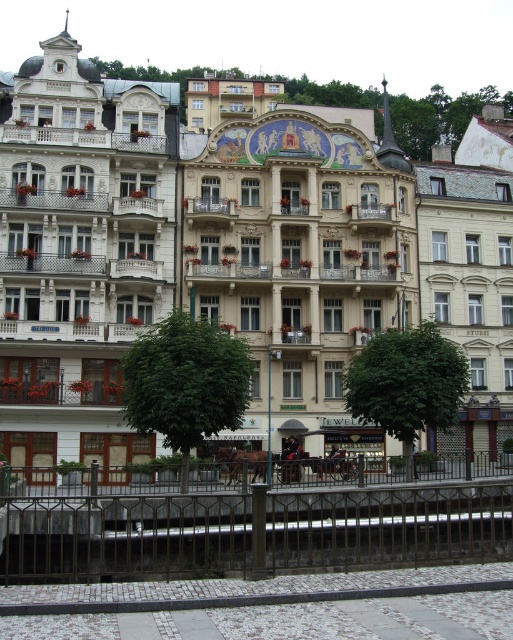
Question: Among these points, which one is farthest from the camera?

Choices:
 (A) (114, 260)
 (B) (207, 218)
 (C) (155, 200)

Answer: (B)

Question: Does white textured building at left lie in front of white stone balcony at center?

Choices:
 (A) no
 (B) yes

Answer: (B)

Question: Does white textured building at left appear under white wrought iron balcony at center?

Choices:
 (A) no
 (B) yes

Answer: (A)

Question: Is white textured building at left positioned at the back of wooden balcony at left?

Choices:
 (A) no
 (B) yes

Answer: (A)

Question: Which point appears closest to the camera in this image?

Choices:
 (A) (231, 262)
 (B) (60, 141)

Answer: (A)

Question: Which of the following is the closest to the observer?

Choices:
 (A) (191, 212)
 (B) (372, 212)

Answer: (A)